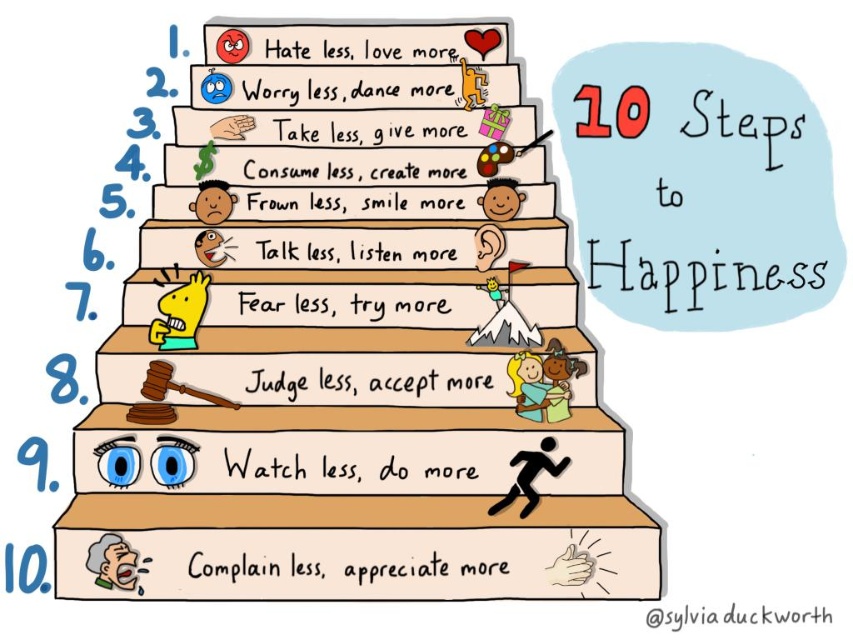
You are standing at the bottom of the staircase in the image and want to reach the golden statue at upper center. There is a smooth skin face at center in your way. Which object is closer to you?

The smooth skin face at center is closer to you than the golden statue at upper center because the golden statue at upper center is positioned under the smooth skin face at center.

You are standing in front of the image and want to touch both the wooden stairs at center and the gray paper at bottom. Which object will you reach first?

You will reach the wooden stairs at center first because it is closer to you than the gray paper at bottom.